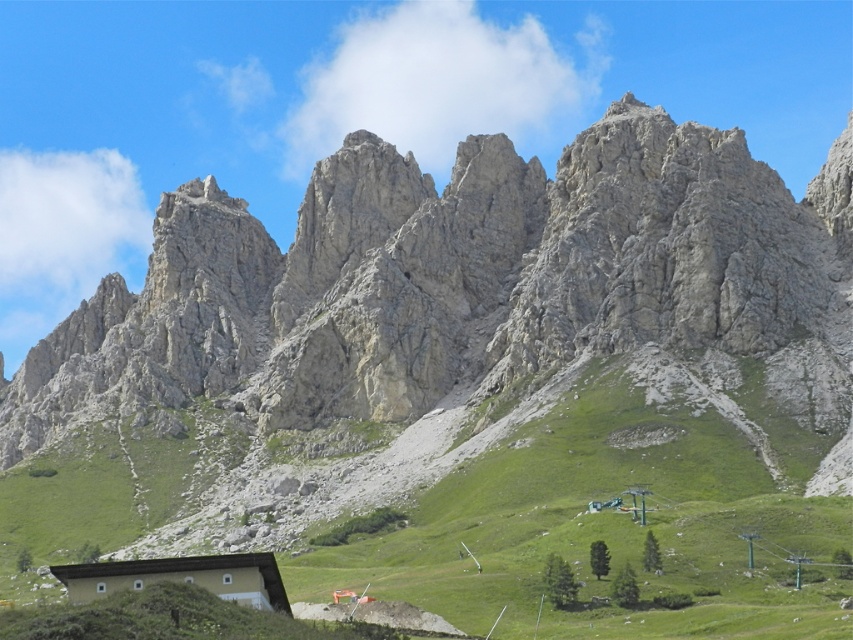
Question: Does green grassy slope at center come in front of light brown wooden hut at lower center?

Choices:
 (A) yes
 (B) no

Answer: (A)

Question: Is green grassy slope at center bigger than light brown wooden hut at lower center?

Choices:
 (A) no
 (B) yes

Answer: (B)

Question: In this image, where is green grassy slope at center located relative to light brown wooden hut at lower center?

Choices:
 (A) above
 (B) below

Answer: (A)

Question: Which of the following is the farthest from the observer?

Choices:
 (A) green grassy slope at center
 (B) light brown wooden hut at lower center

Answer: (B)